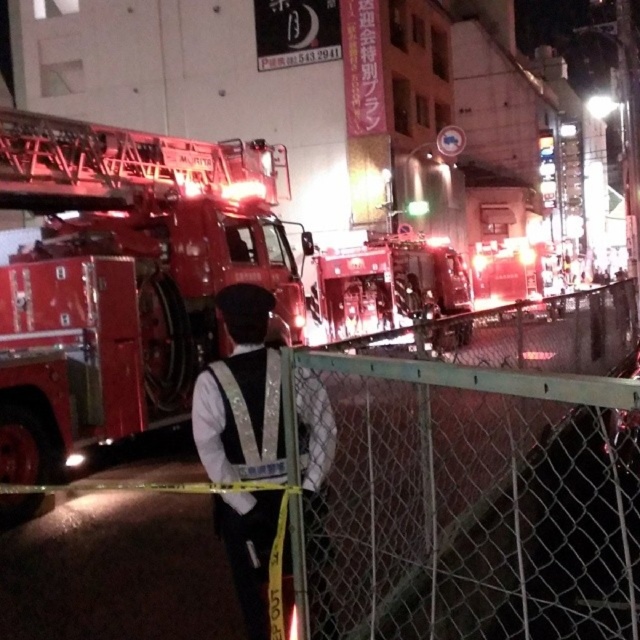
Between shiny red fire truck at center and shiny metallic fire truck at center, which one has more height?

shiny red fire truck at center

Between point (6, 134) and point (412, 284), which one is positioned in front?

Positioned in front is point (6, 134).

At what (x,y) coordinates should I click in order to perform the action: click on shiny red fire truck at center. Please return your answer as a coordinate pair (x, y). Looking at the image, I should click on (125, 278).

Based on the photo, between shiny red fire truck at center and white reflective vest at center, which one appears on the right side from the viewer's perspective?

Positioned to the right is white reflective vest at center.

Is point (116, 300) positioned after point (252, 401)?

That is True.

This screenshot has width=640, height=640. What are the coordinates of `shiny red fire truck at center` in the screenshot? It's located at (125, 278).

Does white reflective vest at center appear on the right side of shiny metallic fire truck at center?

In fact, white reflective vest at center is to the left of shiny metallic fire truck at center.

Does white reflective vest at center have a lesser height compared to shiny metallic fire truck at center?

Incorrect, white reflective vest at center's height does not fall short of shiny metallic fire truck at center's.

Describe the element at coordinates (241, 394) in the screenshot. I see `white reflective vest at center` at that location.

Locate an element on the screen. white reflective vest at center is located at coordinates (241, 394).